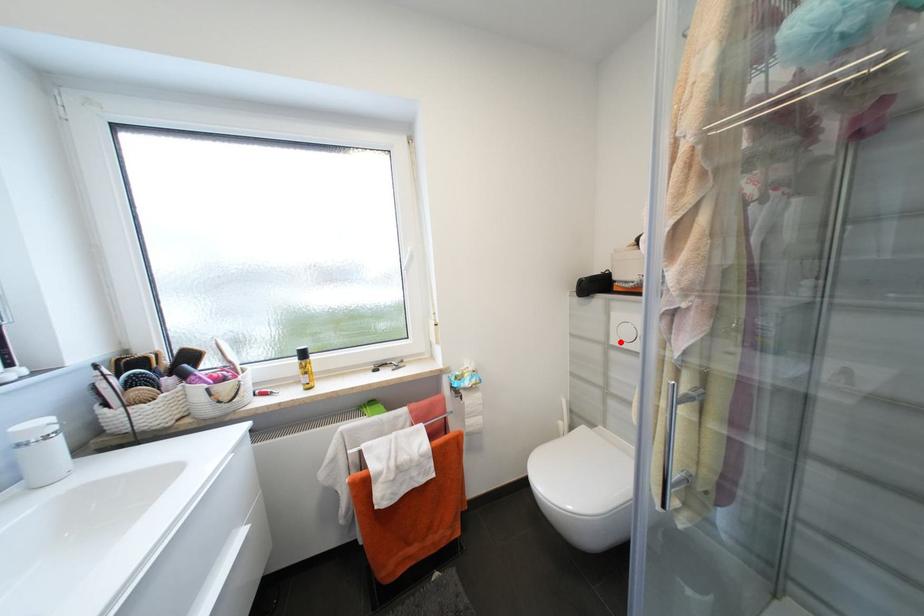
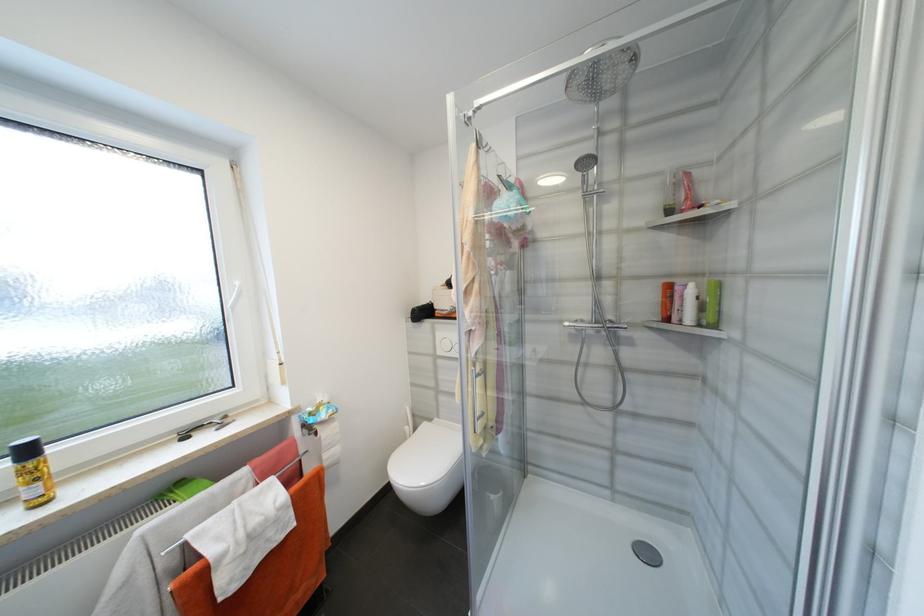
In the second image, find the point that corresponds to the highlighted location in the first image.

(445, 353)